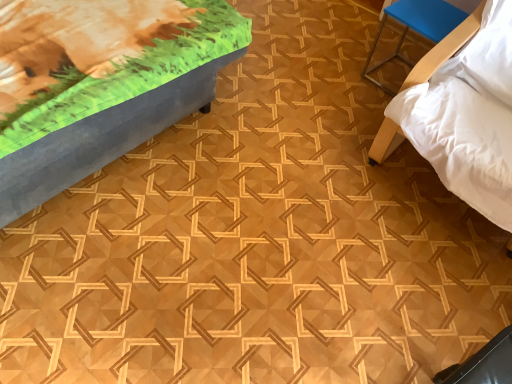
Locate an element on the screen. vacant region to the right of matte gray bench at upper left, acting as the 1th furniture starting from the left is located at coordinates (282, 159).